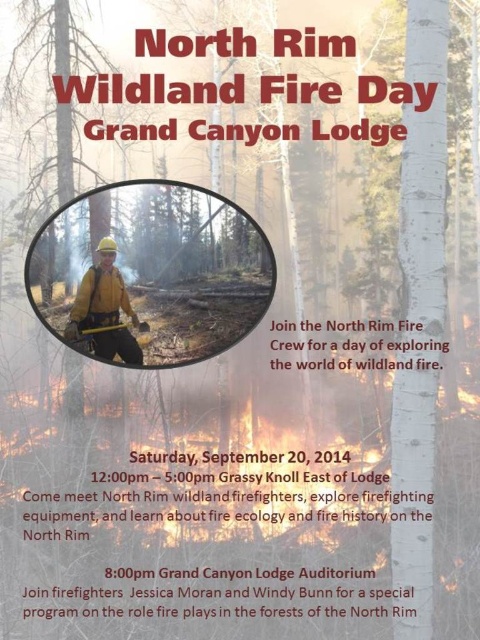
Is smooth bark tree at center to the right of matte yellow helmet at center from the viewer's perspective?

In fact, smooth bark tree at center is to the left of matte yellow helmet at center.

Can you confirm if smooth bark tree at center is taller than matte yellow helmet at center?

Yes, smooth bark tree at center is taller than matte yellow helmet at center.

Is point (70, 60) farther from viewer compared to point (95, 349)?

That is False.

Image resolution: width=480 pixels, height=640 pixels. I want to click on smooth bark tree at center, so pyautogui.click(x=44, y=100).